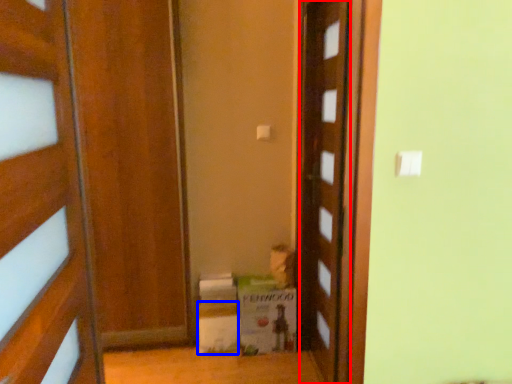
Question: Which object is further to the camera taking this photo, door (highlighted by a red box) or cardboard box (highlighted by a blue box)?

Choices:
 (A) door
 (B) cardboard box

Answer: (B)